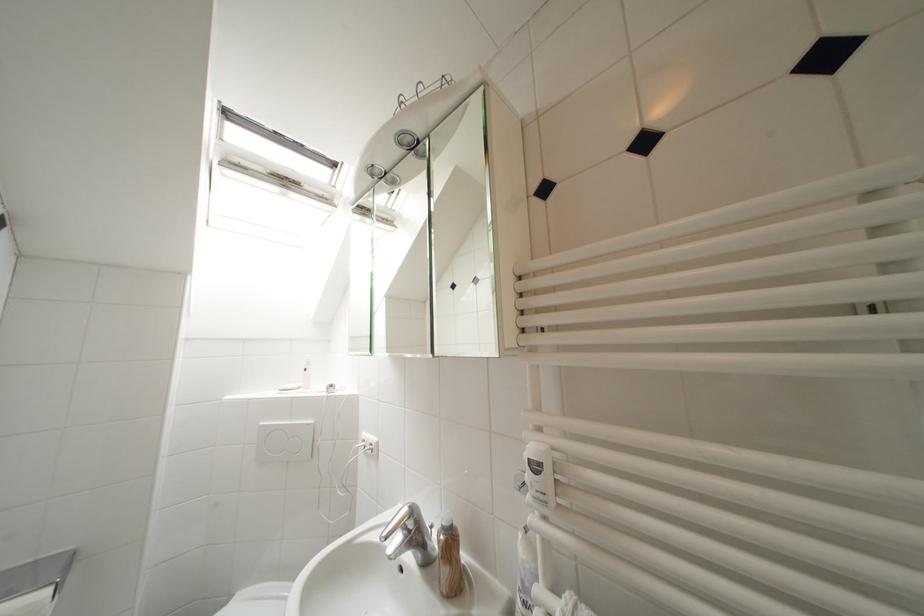
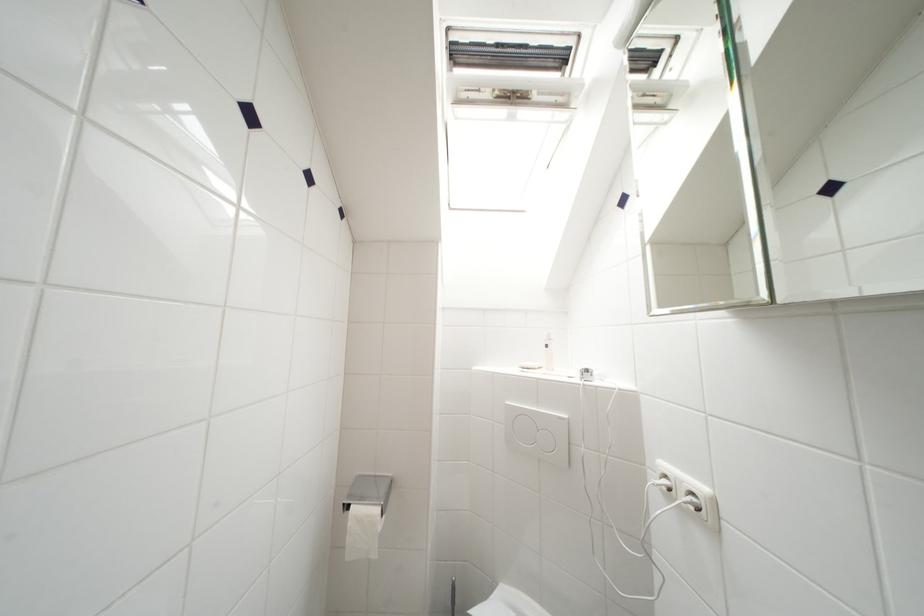
Find the pixel in the second image that matches point 336,174 in the first image.

(565, 77)